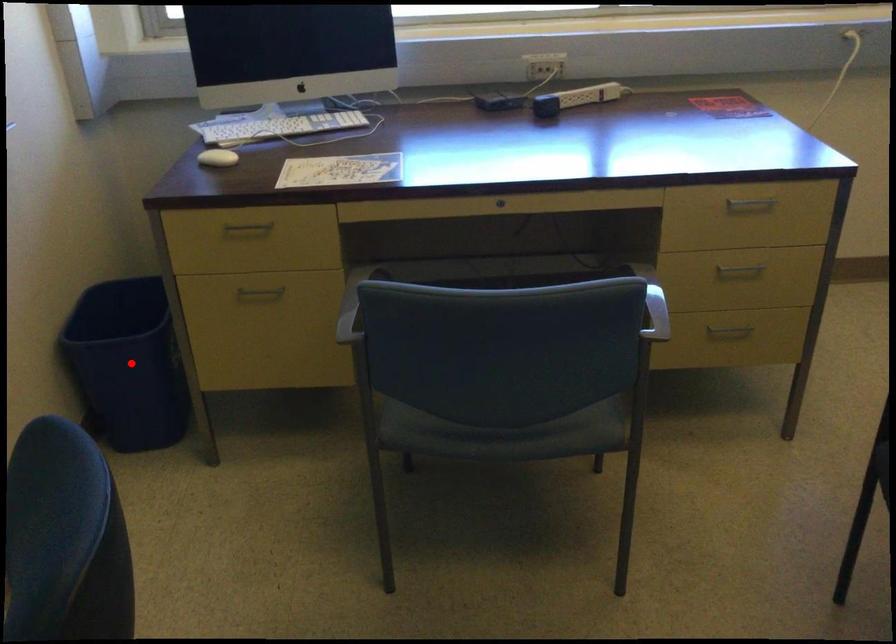
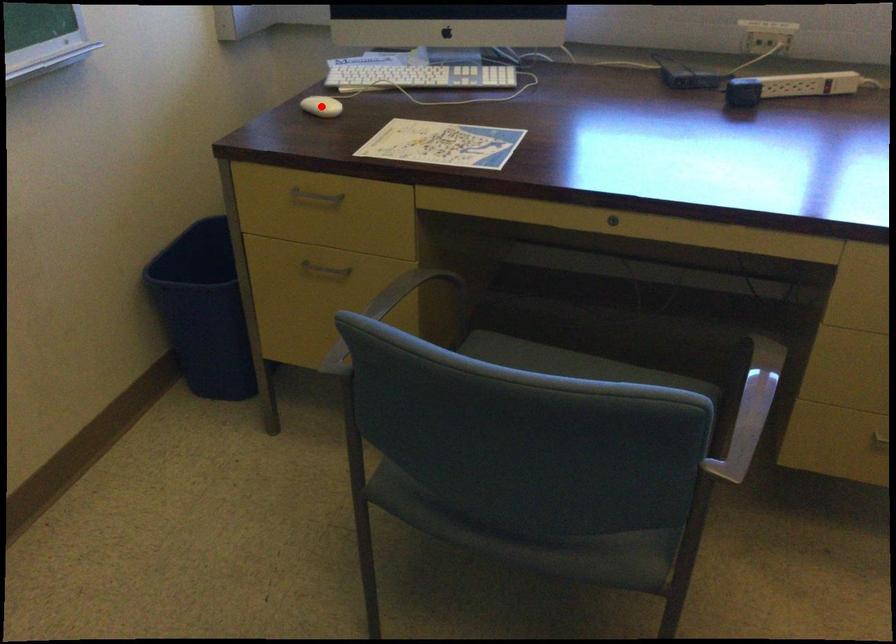
I am providing you with two images of the same scene from different viewpoints. A red point is marked on the first image and another point is marked on the second image. Does the point marked in image1 correspond to the same location as the one in image2?

No